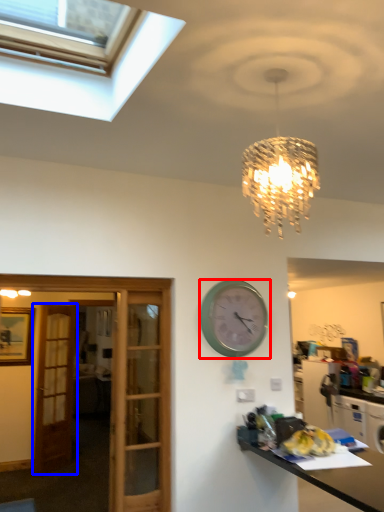
Question: Which point is closer to the camera, wall clock (highlighted by a red box) or door (highlighted by a blue box)?

Choices:
 (A) wall clock
 (B) door

Answer: (A)